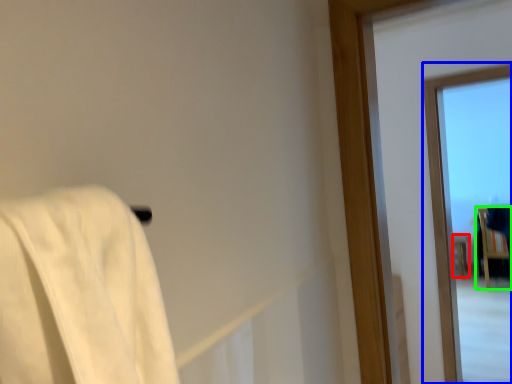
Question: Which object is positioned farthest from furniture (highlighted by a red box)? Select from window (highlighted by a blue box) and furniture (highlighted by a green box).

Choices:
 (A) window
 (B) furniture

Answer: (A)